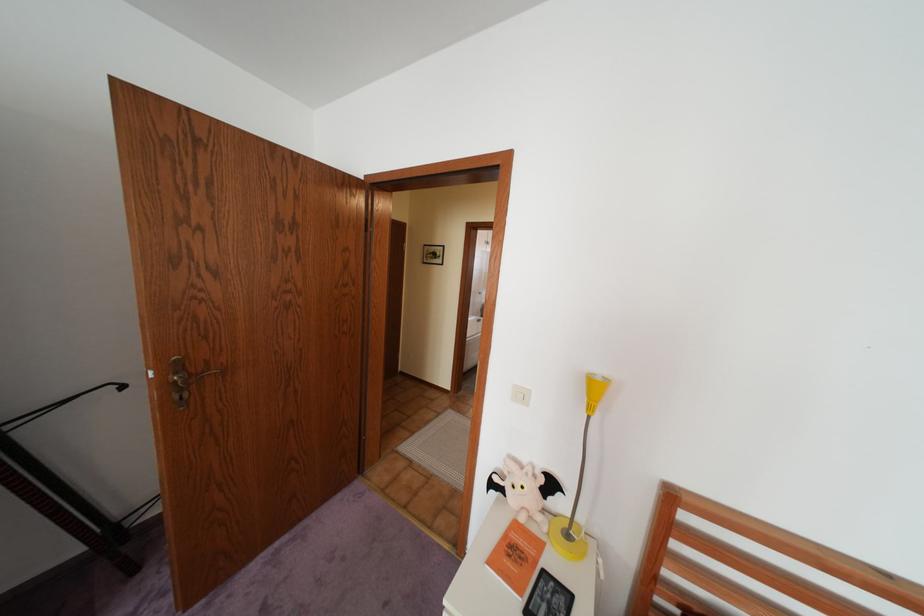
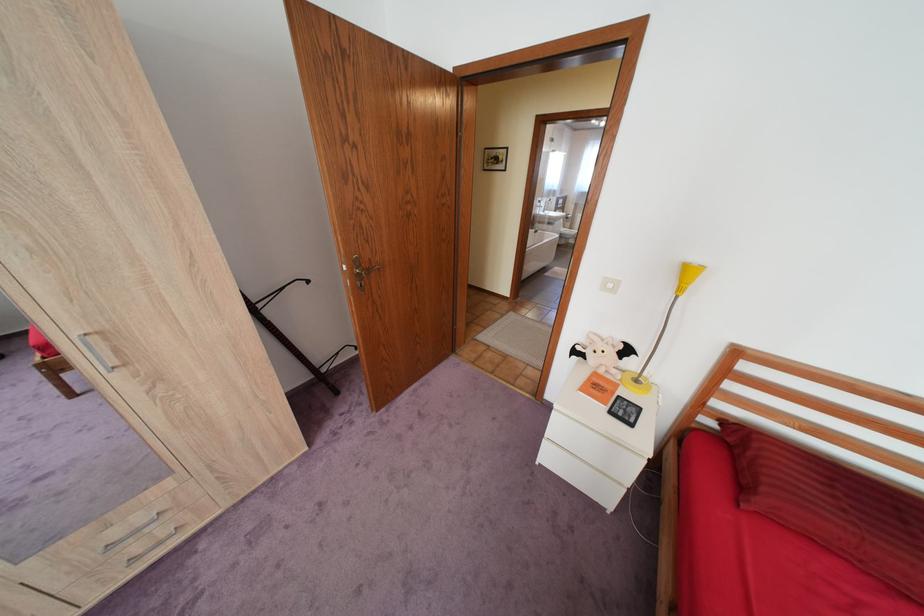
The point at (526, 524) is marked in the first image. Where is the corresponding point in the second image?

(606, 373)